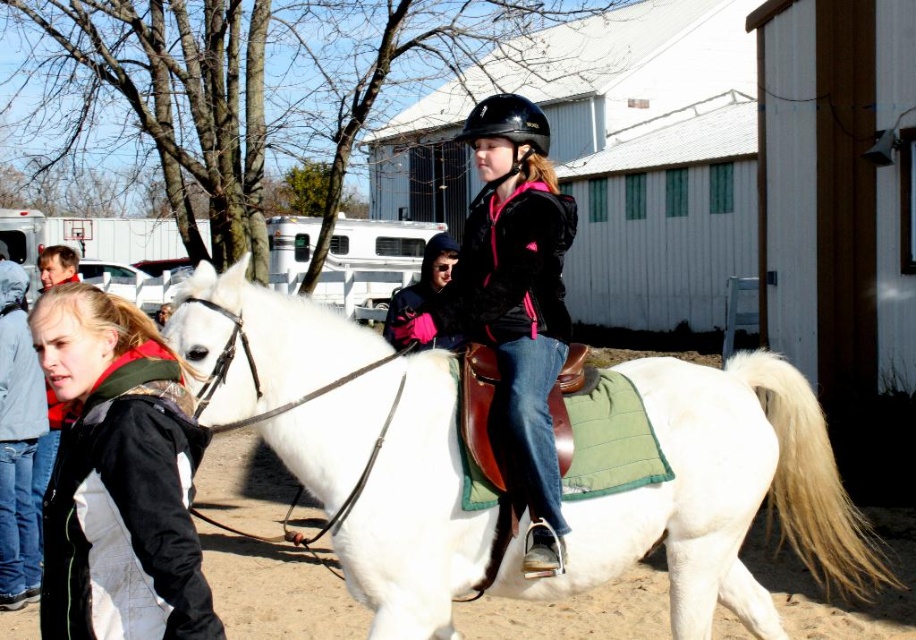
Which is below, white matte/suede horse at center or matte black helmet at center?

Positioned lower is white matte/suede horse at center.

Does point (845, 545) come in front of point (478, 106)?

Yes, point (845, 545) is in front of point (478, 106).

You are a GUI agent. You are given a task and a screenshot of the screen. Output one action in this format:
    pyautogui.click(x=<x>, y=<y>)
    Task: Click on the white matte/suede horse at center
    The image size is (916, 640).
    Given the screenshot: What is the action you would take?
    pyautogui.click(x=715, y=496)

How far apart are white matte/suede horse at center and black hard helmet at center?

white matte/suede horse at center and black hard helmet at center are 2.03 meters apart.

Does white matte/suede horse at center have a lesser height compared to black hard helmet at center?

No.

Who is more distant from viewer, (756, 465) or (544, 150)?

Point (544, 150)

Locate an element on the screen. white matte/suede horse at center is located at coordinates (715, 496).

Does white matte/suede horse at center have a smaller size compared to black fleece jacket at lower left?

No.

Does point (733, 493) lie behind point (68, 637)?

Yes, it is.

What are the coordinates of `white matte/suede horse at center` in the screenshot? It's located at (715, 496).